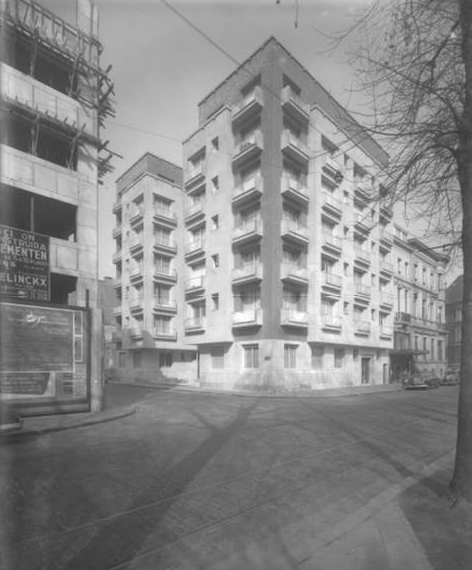
Find the location of a particular element. This screenshot has width=472, height=570. window is located at coordinates (286, 211).